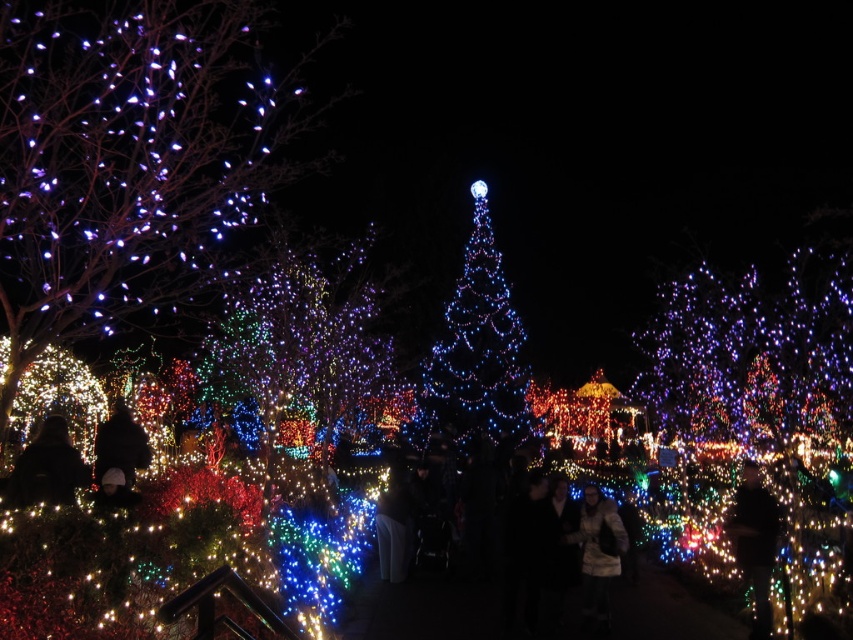
You are standing in the festive nighttime scene and want to locate the exact point at coordinates point (476, 348). According to the scene description, where would this point be located?

The point (476, 348) is located on the illuminated glass Christmas tree at center.

You are a photographer setting up equipment in the festive nighttime scene. You have a black fabric at lower left and an illuminated glass christmas tree at center in your viewfinder. Which object will appear closer to you in the photo?

The illuminated glass christmas tree at center will appear closer to you because the black fabric at lower left is behind it.

You are standing at the center of the festive scene and want to find the illuminated plastic tree at left. Based on its coordinates, which direction should you look to locate it?

The illuminated plastic tree at left is located at coordinates point (126, 161), which means it is positioned to the left and slightly downward from your current position at the center. You should look towards the lower left direction to find it.